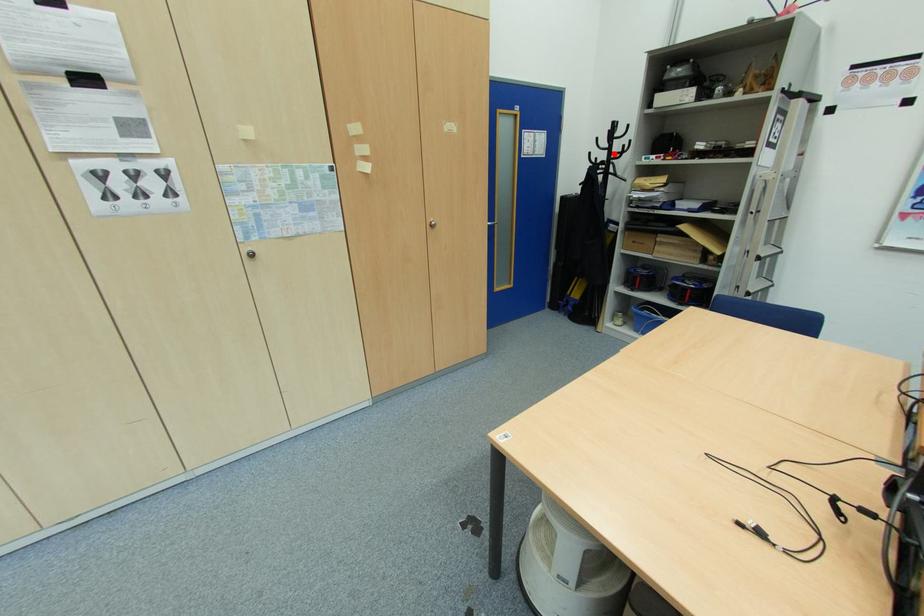
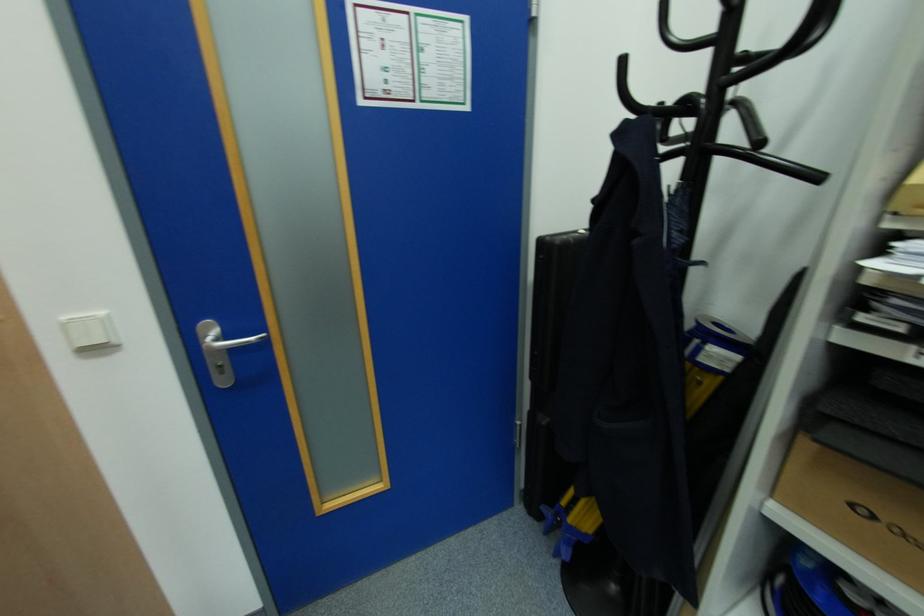
Question: I am providing you with two images of the same scene from different viewpoints. Image1 has a red point marked. In image2, the corresponding 3D location appears at what relative position? Reply with the corresponding letter.

Choices:
 (A) Closer
 (B) Farther

Answer: (B)